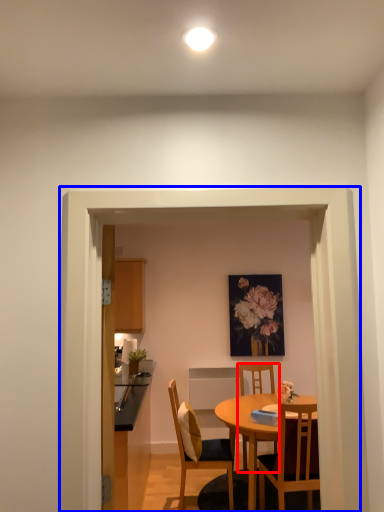
Question: Which point is closer to the camera, chair (highlighted by a red box) or glass door (highlighted by a blue box)?

Choices:
 (A) chair
 (B) glass door

Answer: (B)